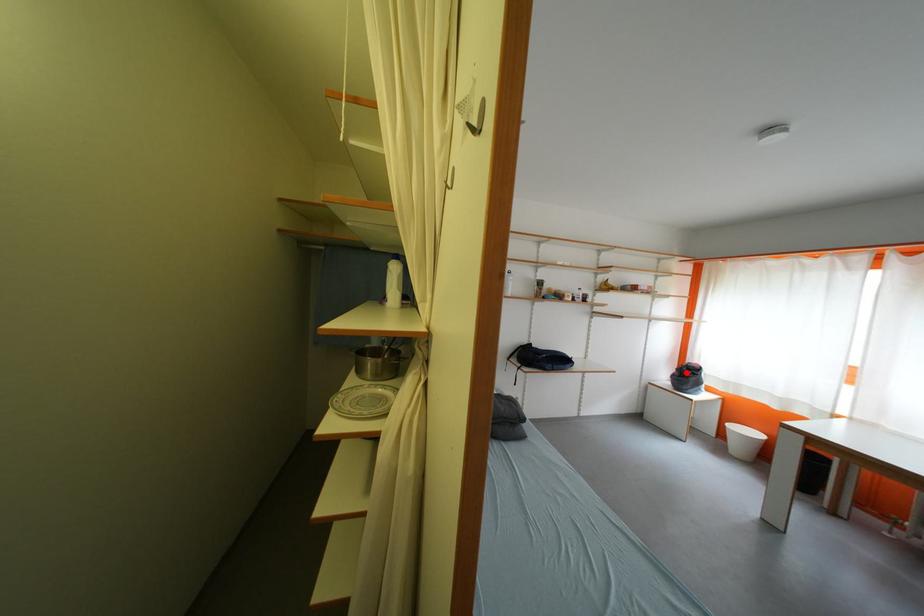
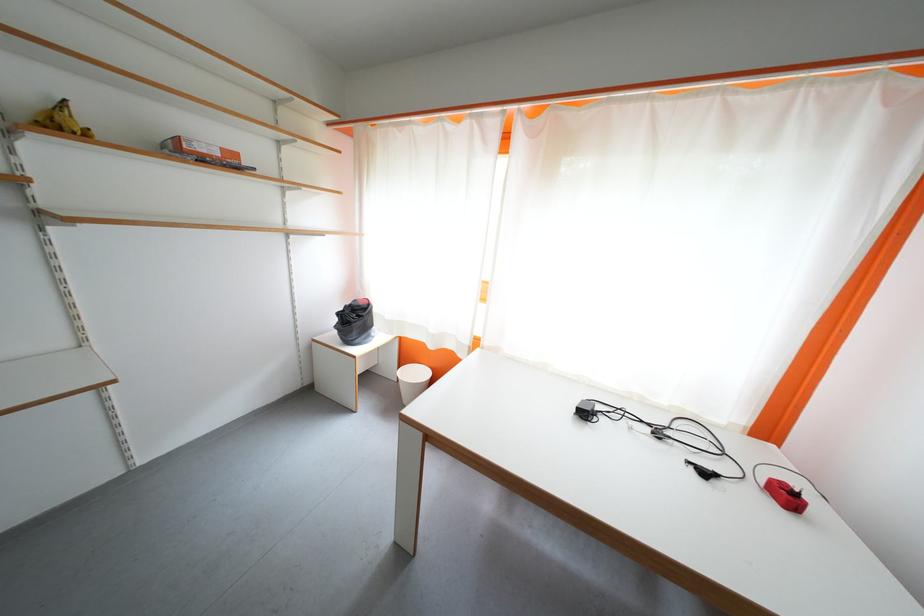
Where in the second image is the point corresponding to the highlighted location from the first image?

(347, 317)